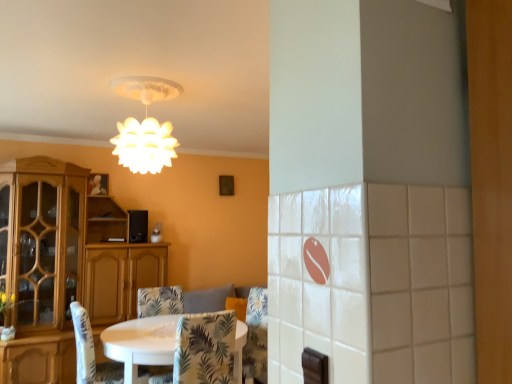
Question: From a real-world perspective, is patterned fabric chair at center, which appears as the first chair when viewed from the front, positioned under white matte lampshade at upper center based on gravity?

Choices:
 (A) yes
 (B) no

Answer: (A)

Question: Is patterned fabric chair at center, the third chair when ordered from back to front, far away from white matte lampshade at upper center?

Choices:
 (A) yes
 (B) no

Answer: (A)

Question: Does patterned fabric chair at center, which appears as the first chair when viewed from the front, have a lesser width compared to white matte lampshade at upper center?

Choices:
 (A) no
 (B) yes

Answer: (A)

Question: From the image's perspective, would you say patterned fabric chair at center, which appears as the first chair when viewed from the front, is shown under white matte lampshade at upper center?

Choices:
 (A) yes
 (B) no

Answer: (A)

Question: Is patterned fabric chair at center, the third chair when ordered from back to front, positioned with its back to white matte lampshade at upper center?

Choices:
 (A) yes
 (B) no

Answer: (B)

Question: In the image, is white fabric chair at lower left, arranged as the 2th chair when viewed from the back, on the left side or the right side of white matte lampshade at upper center?

Choices:
 (A) right
 (B) left

Answer: (B)

Question: In the image, is white fabric chair at lower left, arranged as the 2th chair when viewed from the back, positioned in front of or behind white matte lampshade at upper center?

Choices:
 (A) behind
 (B) front

Answer: (A)

Question: In terms of size, does white fabric chair at lower left, the second chair viewed from the front, appear bigger or smaller than white matte lampshade at upper center?

Choices:
 (A) big
 (B) small

Answer: (A)

Question: From the image's perspective, is white fabric chair at lower left, the second chair viewed from the front, positioned above or below white matte lampshade at upper center?

Choices:
 (A) below
 (B) above

Answer: (A)

Question: Would you say patterned fabric chair at center, the third chair when ordered from back to front, is to the left or to the right of white fabric chair at lower left, arranged as the 2th chair when viewed from the back, in the picture?

Choices:
 (A) right
 (B) left

Answer: (A)

Question: Is patterned fabric chair at center, which appears as the first chair when viewed from the front, inside the boundaries of white fabric chair at lower left, arranged as the 2th chair when viewed from the back, or outside?

Choices:
 (A) outside
 (B) inside

Answer: (A)

Question: From a real-world perspective, is patterned fabric chair at center, the third chair when ordered from back to front, positioned above or below white fabric chair at lower left, arranged as the 2th chair when viewed from the back?

Choices:
 (A) below
 (B) above

Answer: (B)

Question: Is patterned fabric chair at center, the third chair when ordered from back to front, in front of or behind white fabric chair at lower left, arranged as the 2th chair when viewed from the back, in the image?

Choices:
 (A) front
 (B) behind

Answer: (A)

Question: Is wooden cabinet at left taller or shorter than patterned fabric chair at center, which appears as the first chair when viewed from the front?

Choices:
 (A) short
 (B) tall

Answer: (B)

Question: Is wooden cabinet at left inside the boundaries of patterned fabric chair at center, the third chair when ordered from back to front, or outside?

Choices:
 (A) inside
 (B) outside

Answer: (B)